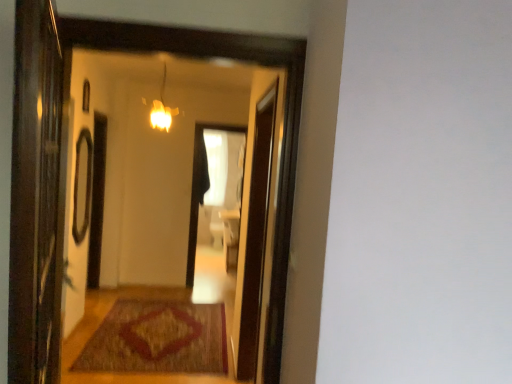
Question: Visually, is matte glass light fixture at upper center positioned to the left or to the right of transparent glass screen door at left, acting as the first screen door starting from the front?

Choices:
 (A) left
 (B) right

Answer: (A)

Question: From a real-world perspective, is matte glass light fixture at upper center above or below transparent glass screen door at left, acting as the first screen door starting from the front?

Choices:
 (A) below
 (B) above

Answer: (B)

Question: Which object is the farthest from the matte glass window at upper left?

Choices:
 (A) transparent glass screen door at center, which appears as the 1th screen door when viewed from the back
 (B) brown woven mat at center
 (C) matte glass light fixture at upper center
 (D) transparent glass screen door at left, placed as the 2th screen door when sorted from back to front
 (E) matte wooden mirror at center

Answer: (D)

Question: Which of these objects is positioned closest to the brown woven mat at center?

Choices:
 (A) transparent glass screen door at center, marked as the 2th screen door in a left-to-right arrangement
 (B) transparent glass screen door at left, which appears as the 2th screen door when viewed from the right
 (C) matte wooden mirror at center
 (D) matte glass window at upper left
 (E) matte glass light fixture at upper center

Answer: (A)